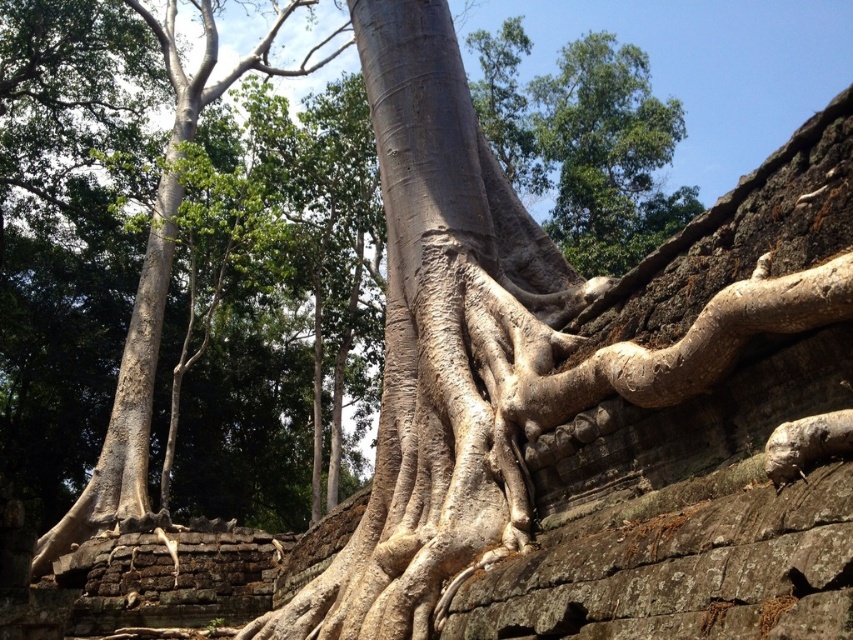
You are standing in the ancient stone ruins and see the tree with its roots growing over the stones. There is a specific point marked at coordinates (444, 346). What object from the scene is located at this point?

The smooth gray bark at center is located at point (444, 346).